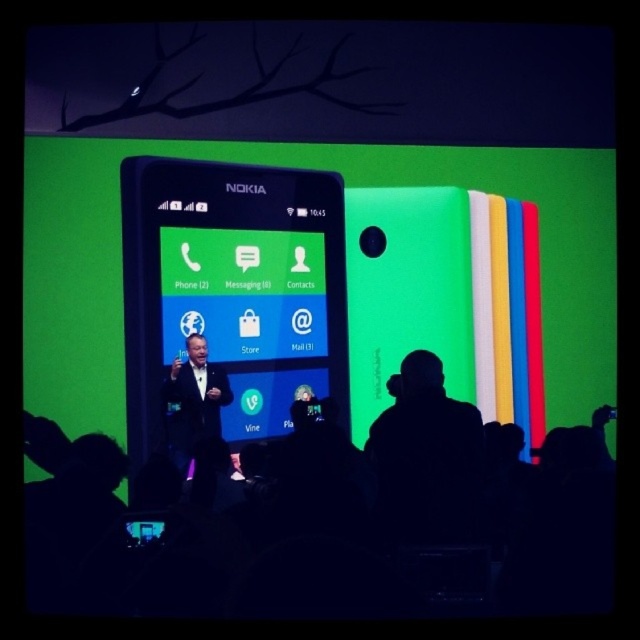
Does black glossy phone at center have a greater height compared to shiny black suit at center?

Yes, black glossy phone at center is taller than shiny black suit at center.

Does point (196, 204) come farther from viewer compared to point (220, 387)?

No.

I want to click on black glossy phone at center, so click(232, 289).